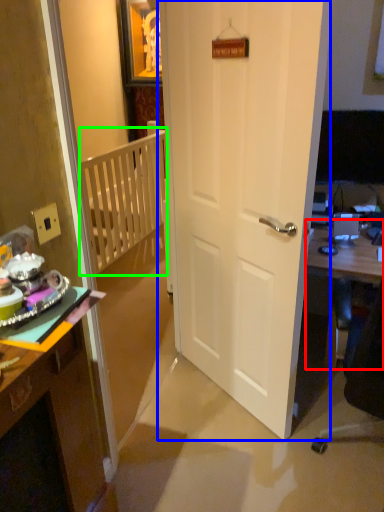
Question: Based on their relative distances, which object is nearer to table (highlighted by a red box)? Choose from door (highlighted by a blue box) and balustrade (highlighted by a green box).

Choices:
 (A) door
 (B) balustrade

Answer: (A)